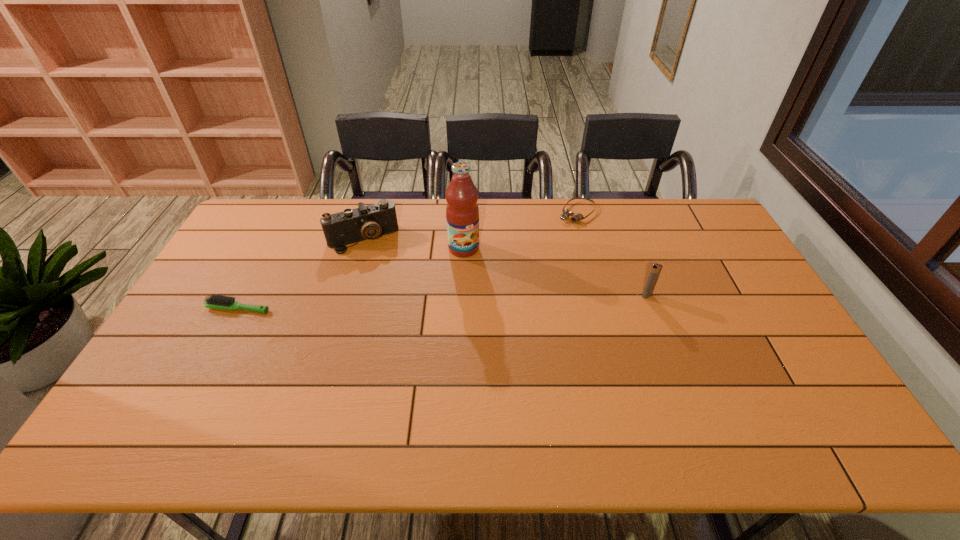
This screenshot has width=960, height=540. What are the coordinates of `free spot between the second object from left to right and the igniter` in the screenshot? It's located at (505, 267).

At what (x,y) coordinates should I click in order to perform the action: click on blank region between the hairbrush and the goggles. Please return your answer as a coordinate pair (x, y). Image resolution: width=960 pixels, height=540 pixels. Looking at the image, I should click on (408, 260).

This screenshot has width=960, height=540. In order to click on unoccupied area between the camera and the leftmost object in this screenshot , I will do `click(300, 273)`.

This screenshot has width=960, height=540. Find the location of `free space that is in between the camera and the rightmost object`. free space that is in between the camera and the rightmost object is located at coordinates (505, 267).

The width and height of the screenshot is (960, 540). What are the coordinates of `free space between the camera and the hairbrush` in the screenshot? It's located at (300, 273).

Locate an element on the screen. Image resolution: width=960 pixels, height=540 pixels. empty location between the nearest object and the third object from left to right is located at coordinates (351, 278).

You are a GUI agent. You are given a task and a screenshot of the screen. Output one action in this format:
    pyautogui.click(x=<x>, y=<y>)
    Task: Click on the object that ranks as the fourth closest to the tallest object
    The width and height of the screenshot is (960, 540).
    Given the screenshot: What is the action you would take?
    pyautogui.click(x=214, y=301)

The width and height of the screenshot is (960, 540). Identify the location of the closest object to the second nearest object. (566, 213).

Identify the location of vacant region that satisfies the following two spatial constraints: 1. on the back side of the leftmost object; 2. on the right side of the fourth object from right to left. The image size is (960, 540). (275, 239).

This screenshot has height=540, width=960. I want to click on free spot that satisfies the following two spatial constraints: 1. on the back side of the second object from right to left; 2. on the left side of the third object from left to right, so click(x=465, y=212).